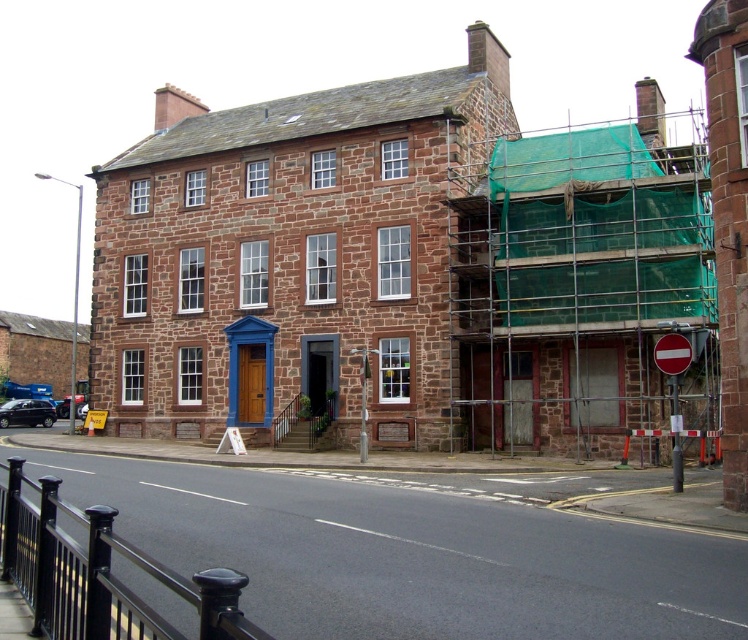
Question: Is red plastic sign at lower right wider than red glossy stop sign at center right?

Choices:
 (A) yes
 (B) no

Answer: (B)

Question: Does red plastic sign at lower right appear on the left side of red glossy stop sign at center right?

Choices:
 (A) yes
 (B) no

Answer: (A)

Question: Which point appears farthest from the camera in this image?

Choices:
 (A) (681, 419)
 (B) (669, 337)

Answer: (A)

Question: Which point appears farthest from the camera in this image?

Choices:
 (A) (684, 272)
 (B) (683, 356)

Answer: (A)

Question: Among these objects, which one is nearest to the camera?

Choices:
 (A) green mesh scaffolding at right
 (B) red glossy stop sign at center right
 (C) red plastic sign at lower right

Answer: (B)

Question: Is green mesh scaffolding at right positioned before red plastic sign at lower right?

Choices:
 (A) no
 (B) yes

Answer: (A)